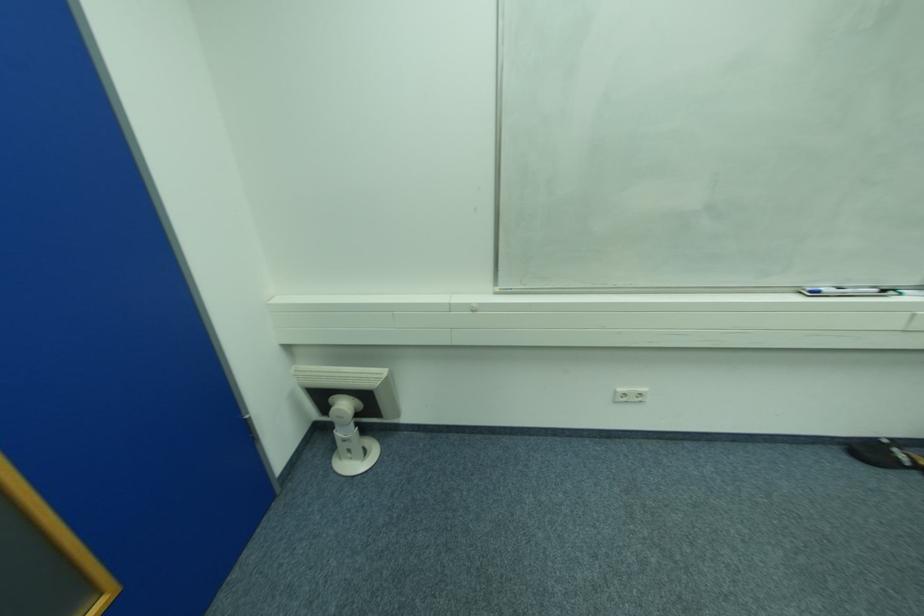
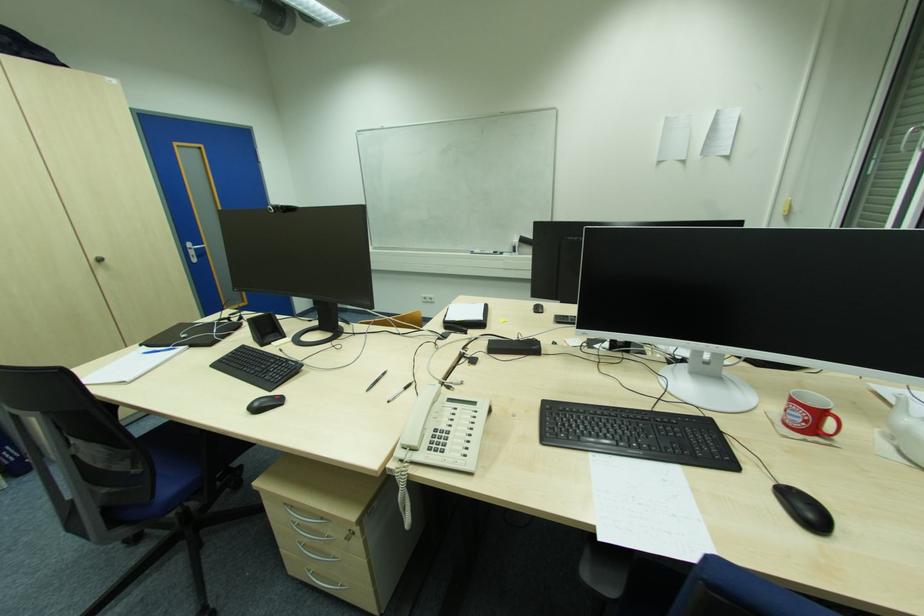
What movement of the cameraman would produce the second image?

The movement direction of the cameraman is right, backward.